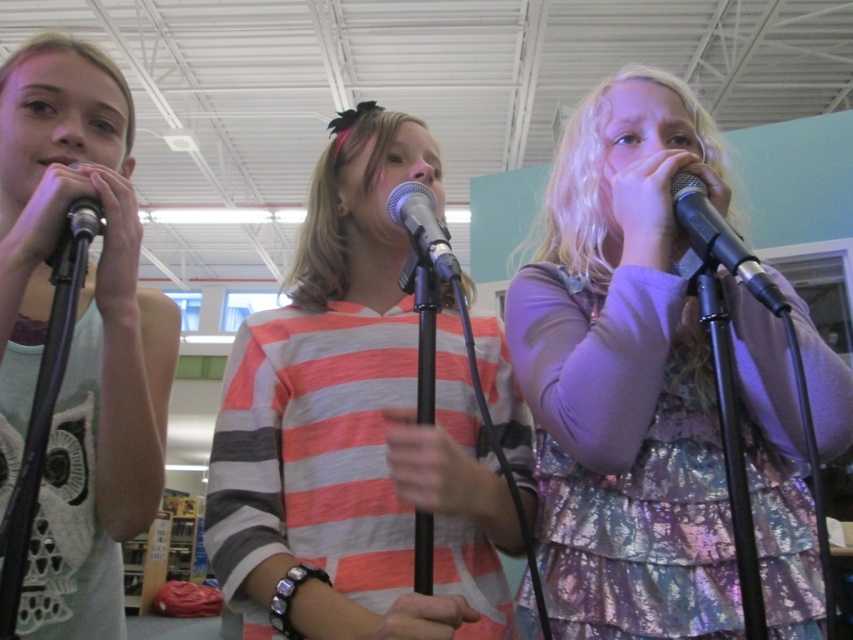
Question: Which of these objects is positioned closest to the shiny purple dress at center?

Choices:
 (A) metallic silver microphone at left
 (B) striped cotton shirt at center
 (C) metallic silver microphone at center

Answer: (B)

Question: Which object is farther from the camera taking this photo?

Choices:
 (A) striped cotton shirt at center
 (B) matte white tank top at left
 (C) metallic silver microphone at right
 (D) metallic silver microphone at center

Answer: (B)

Question: Which of these objects is positioned closest to the matte white tank top at left?

Choices:
 (A) metallic silver microphone at center
 (B) metallic silver microphone at right
 (C) striped cotton shirt at center
 (D) metallic silver microphone at left

Answer: (D)

Question: Observing the image, what is the correct spatial positioning of metallic silver microphone at center in reference to metallic silver microphone at left?

Choices:
 (A) above
 (B) below

Answer: (B)

Question: Does metallic silver microphone at center appear on the left side of metallic silver microphone at left?

Choices:
 (A) yes
 (B) no

Answer: (B)

Question: Is the position of matte white tank top at left less distant than that of metallic silver microphone at right?

Choices:
 (A) yes
 (B) no

Answer: (B)